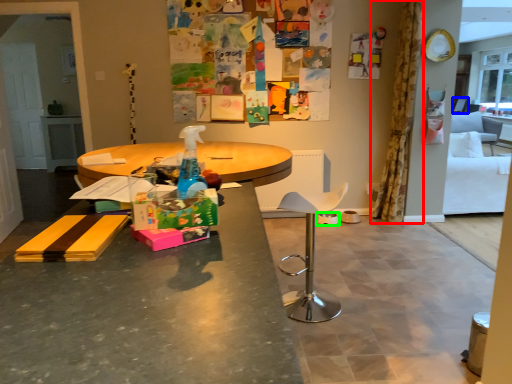
Question: Which object is positioned closest to curtain (highlighted by a red box)? Select from armchair (highlighted by a blue box) and bowl (highlighted by a green box).

Choices:
 (A) armchair
 (B) bowl

Answer: (B)